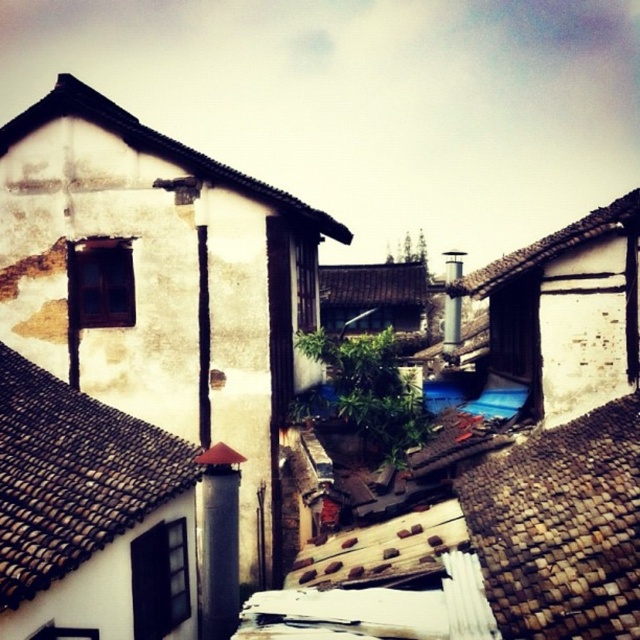
Question: Which object appears farthest from the camera in this image?

Choices:
 (A) brown tile roof at center
 (B) white textured roof at upper left
 (C) brown tile roof at upper right

Answer: (A)

Question: Which object appears farthest from the camera in this image?

Choices:
 (A) brown shingles at lower right
 (B) white textured roof at upper left
 (C) brown tile roof at upper right
 (D) brown tile roof at upper left

Answer: (B)

Question: Can you confirm if brown shingles at lower right is smaller than brown tile roof at upper right?

Choices:
 (A) yes
 (B) no

Answer: (A)

Question: Is white textured roof at upper left to the left of brown tile roof at center from the viewer's perspective?

Choices:
 (A) yes
 (B) no

Answer: (A)

Question: Which object is positioned closest to the brown tile roof at center?

Choices:
 (A) brown tile roof at upper right
 (B) brown shingles at lower right
 (C) brown tile roof at upper left

Answer: (C)

Question: Is brown shingles at lower right in front of white textured roof at upper left?

Choices:
 (A) yes
 (B) no

Answer: (A)